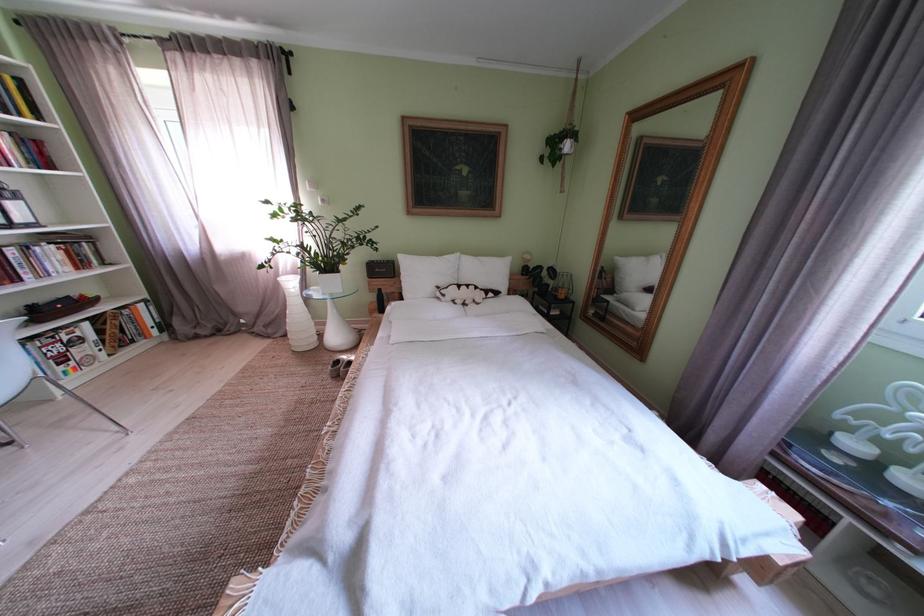
The height and width of the screenshot is (616, 924). What do you see at coordinates (526, 262) in the screenshot? I see `the bedside lamp` at bounding box center [526, 262].